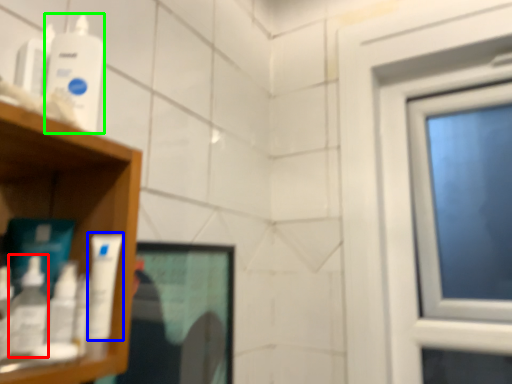
Question: Based on their relative distances, which object is nearer to mouthwash (highlighted by a red box)? Choose from mouthwash (highlighted by a blue box) and mouthwash (highlighted by a green box).

Choices:
 (A) mouthwash
 (B) mouthwash

Answer: (A)